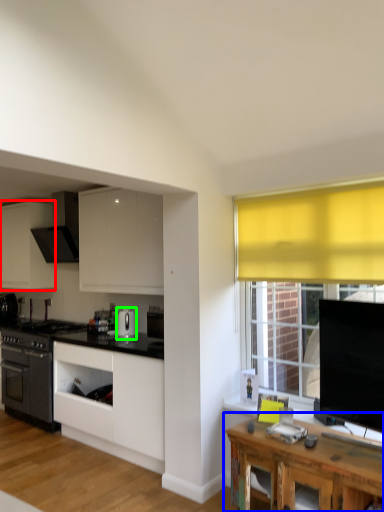
Question: Which object is the farthest from cabinetry (highlighted by a red box)? Choose among these: table (highlighted by a blue box) or kitchen appliance (highlighted by a green box).

Choices:
 (A) table
 (B) kitchen appliance

Answer: (A)